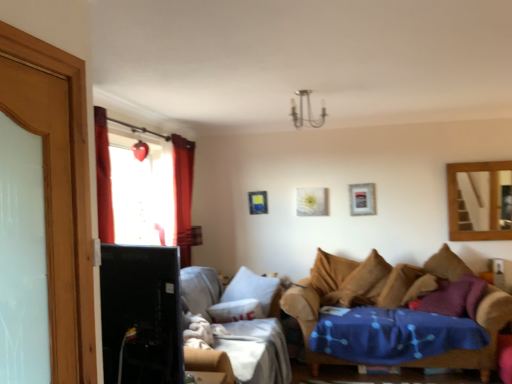
The width and height of the screenshot is (512, 384). Describe the element at coordinates (420, 288) in the screenshot. I see `brown fabric pillow at right, acting as the 1th pillow starting from the left` at that location.

Find the location of a particular element. The image size is (512, 384). white matte picture frame at upper center, which is the 2th picture frame in back-to-front order is located at coordinates (311, 202).

Where is `velvet beige couch at lower right, which ranks as the 1th studio couch in left-to-right order`? This screenshot has width=512, height=384. velvet beige couch at lower right, which ranks as the 1th studio couch in left-to-right order is located at coordinates (256, 350).

Does wooden screen door at left contain wooden mirror at upper right?

No, wooden mirror at upper right is not surrounded by wooden screen door at left.

Considering the sizes of wooden screen door at left and wooden mirror at upper right in the image, is wooden screen door at left bigger or smaller than wooden mirror at upper right?

wooden screen door at left is smaller than wooden mirror at upper right.

Is wooden screen door at left facing away from wooden mirror at upper right?

wooden screen door at left does not have its back to wooden mirror at upper right.

From the image's perspective, is purple soft pillow at right, the 1th pillow viewed from the right, under metallic silver picture frame at upper center, the 3th picture frame when ordered from back to front?

Indeed, from the image's perspective, purple soft pillow at right, the 1th pillow viewed from the right, is shown beneath metallic silver picture frame at upper center, the 3th picture frame when ordered from back to front.

Considering the relative sizes of purple soft pillow at right, acting as the 2th pillow starting from the left, and metallic silver picture frame at upper center, the 3th picture frame when ordered from back to front, in the image provided, is purple soft pillow at right, acting as the 2th pillow starting from the left, smaller than metallic silver picture frame at upper center, the 3th picture frame when ordered from back to front,?

Incorrect, purple soft pillow at right, acting as the 2th pillow starting from the left, is not smaller in size than metallic silver picture frame at upper center, the 3th picture frame when ordered from back to front.

Where is `the 1st pillow below the metallic silver picture frame at upper center, which ranks as the 1th picture frame in front-to-back order (from the image's perspective)`? the 1st pillow below the metallic silver picture frame at upper center, which ranks as the 1th picture frame in front-to-back order (from the image's perspective) is located at coordinates (446, 265).

Which of these two, metallic silver picture frame at upper center, the 3th picture frame in the left-to-right sequence, or wooden mirror at upper right, is thinner?

With smaller width is metallic silver picture frame at upper center, the 3th picture frame in the left-to-right sequence.

This screenshot has width=512, height=384. In the image, there is a wooden mirror at upper right. Identify the location of picture frame above it (from the image's perspective). (362, 199).

From the image's perspective, does metallic silver picture frame at upper center, which is the 1th picture frame from right to left, appear lower than wooden mirror at upper right?

Actually, metallic silver picture frame at upper center, which is the 1th picture frame from right to left, appears above wooden mirror at upper right in the image.

Considering the relative positions of wooden mirror at upper right and black glossy tv at left in the image provided, is wooden mirror at upper right to the left of black glossy tv at left from the viewer's perspective?

No, wooden mirror at upper right is not to the left of black glossy tv at left.

Is wooden mirror at upper right oriented towards black glossy tv at left?

No, wooden mirror at upper right is not facing towards black glossy tv at left.

From the image's perspective, which is below, wooden mirror at upper right or black glossy tv at left?

black glossy tv at left appears lower in the image.

From a real-world perspective, between black glossy tv at left and velvet brown couch at lower right, the 1th studio couch when ordered from right to left, who is vertically higher?

black glossy tv at left, from a real-world perspective.

Is black glossy tv at left directly adjacent to velvet brown couch at lower right, the 1th studio couch when ordered from right to left?

They are not placed beside each other.

What's the angular difference between black glossy tv at left and velvet brown couch at lower right, the 1th studio couch when ordered from right to left,'s facing directions?

They differ by 163 degrees in their facing directions.

Does point (123, 373) come closer to viewer compared to point (414, 363)?

Yes, point (123, 373) is in front of point (414, 363).

Would you say wooden mirror at upper right is inside or outside velvet beige couch at lower right, arranged as the 2th studio couch when viewed from the right?

wooden mirror at upper right is not inside velvet beige couch at lower right, arranged as the 2th studio couch when viewed from the right, it's outside.

From a real-world perspective, which object rests below the other?

velvet beige couch at lower right, which ranks as the 1th studio couch in left-to-right order, from a real-world perspective.

From the picture: Would you say wooden mirror at upper right is to the left or to the right of velvet beige couch at lower right, arranged as the 2th studio couch when viewed from the right, in the picture?

Based on their positions, wooden mirror at upper right is located to the right of velvet beige couch at lower right, arranged as the 2th studio couch when viewed from the right.

Locate an element on the screen. The height and width of the screenshot is (384, 512). studio couch that appears on the right of metallic silver picture frame at upper center, the 3th picture frame when ordered from back to front is located at coordinates (317, 301).

From the image's perspective, is velvet brown couch at lower right, the 1th studio couch when ordered from right to left, positioned above or below metallic silver picture frame at upper center, which is the 1th picture frame from right to left?

From the image's perspective, velvet brown couch at lower right, the 1th studio couch when ordered from right to left, appears below metallic silver picture frame at upper center, which is the 1th picture frame from right to left.

Is velvet brown couch at lower right, the second studio couch when ordered from left to right, in front of or behind metallic silver picture frame at upper center, which is the 1th picture frame from right to left, in the image?

Clearly, velvet brown couch at lower right, the second studio couch when ordered from left to right, is in front of metallic silver picture frame at upper center, which is the 1th picture frame from right to left.

Locate an element on the screen. This screenshot has height=384, width=512. screen door below the wooden mirror at upper right (from the image's perspective) is located at coordinates (72, 177).

The image size is (512, 384). I want to click on the 1st picture frame to the left of the purple soft pillow at right, the 1th pillow viewed from the right, starting your count from the anchor, so click(362, 199).

Based on their spatial positions, is wooden screen door at left or purple soft pillow at right, acting as the 2th pillow starting from the left, further from matte blue picture frame at center, the 3th picture frame viewed from the front?

Among the two, wooden screen door at left is located further to matte blue picture frame at center, the 3th picture frame viewed from the front.

Considering their positions, is purple soft pillow at right, the 1th pillow viewed from the right, positioned closer to matte blue picture frame at center, the 3th picture frame viewed from the front, than black glossy tv at left?

purple soft pillow at right, the 1th pillow viewed from the right.

From the picture: Considering their positions, is white matte picture frame at upper center, the 2th picture frame in the front-to-back sequence, positioned further to velvet beige couch at lower right, which ranks as the 1th studio couch in left-to-right order, than velvet brown couch at lower right, the second studio couch when ordered from left to right?

The object further to velvet beige couch at lower right, which ranks as the 1th studio couch in left-to-right order, is white matte picture frame at upper center, the 2th picture frame in the front-to-back sequence.

Looking at the image, which one is located closer to metallic silver picture frame at upper center, which ranks as the 1th picture frame in front-to-back order, white matte picture frame at upper center, the second picture frame viewed from the left, or velvet beige couch at lower right, arranged as the 2th studio couch when viewed from the right?

white matte picture frame at upper center, the second picture frame viewed from the left.

Based on their spatial positions, is purple soft pillow at right, the 1th pillow viewed from the right, or velvet brown couch at lower right, the 1th studio couch when ordered from right to left, closer to brown fabric pillow at right, acting as the 1th pillow starting from the left?

velvet brown couch at lower right, the 1th studio couch when ordered from right to left, is positioned closer to the anchor brown fabric pillow at right, acting as the 1th pillow starting from the left.

Estimate the real-world distances between objects in this image. Which object is further from matte blue picture frame at center, the 3th picture frame viewed from the front, wooden screen door at left or wooden mirror at upper right?

wooden screen door at left lies further to matte blue picture frame at center, the 3th picture frame viewed from the front, than the other object.

In the scene shown: Looking at the image, which one is located further to metallic silver picture frame at upper center, the 3th picture frame in the left-to-right sequence, purple soft pillow at right, the 1th pillow viewed from the right, or wooden mirror at upper right?

wooden mirror at upper right lies further to metallic silver picture frame at upper center, the 3th picture frame in the left-to-right sequence, than the other object.

Estimate the real-world distances between objects in this image. Which object is closer to wooden mirror at upper right, white matte picture frame at upper center, the 2th picture frame in the front-to-back sequence, or brown fabric pillow at right, acting as the 1th pillow starting from the left?

The object closer to wooden mirror at upper right is brown fabric pillow at right, acting as the 1th pillow starting from the left.

Where is `appliance between wooden screen door at left and brown fabric pillow at right, the second pillow in the right-to-left sequence, along the z-axis`? The height and width of the screenshot is (384, 512). appliance between wooden screen door at left and brown fabric pillow at right, the second pillow in the right-to-left sequence, along the z-axis is located at coordinates (141, 315).

I want to click on appliance positioned between wooden screen door at left and white matte picture frame at upper center, which is the second picture frame in right-to-left order, from near to far, so [x=141, y=315].

Find the location of a particular element. This screenshot has height=384, width=512. picture frame between matte blue picture frame at center, which is counted as the third picture frame, starting from the right, and metallic silver picture frame at upper center, which ranks as the 1th picture frame in front-to-back order is located at coordinates (311, 202).

This screenshot has width=512, height=384. Identify the location of pillow between metallic silver picture frame at upper center, which is the 1th picture frame from right to left, and brown fabric pillow at right, acting as the 1th pillow starting from the left, from top to bottom. (446, 265).